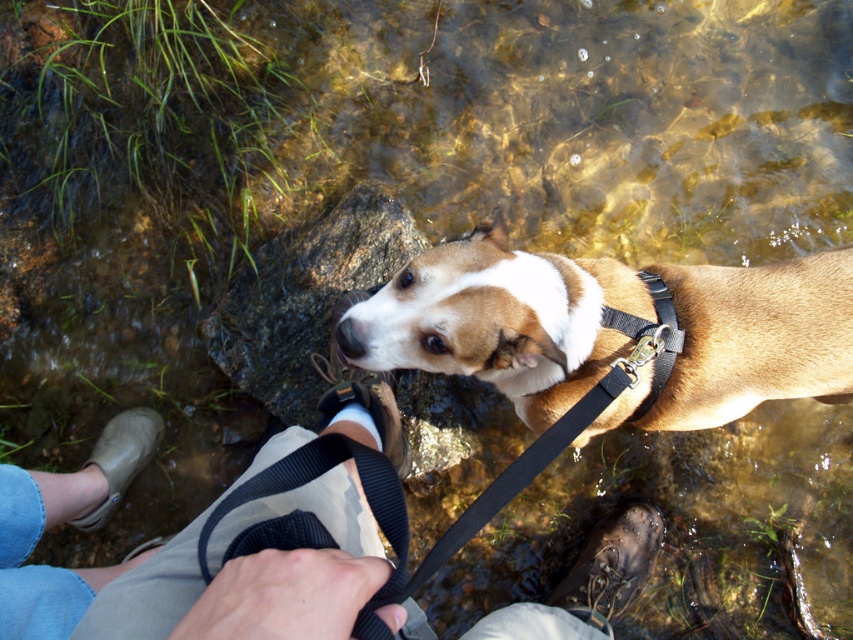
Question: Is brown matte dog at center to the right of brown leather boot at lower right from the viewer's perspective?

Choices:
 (A) no
 (B) yes

Answer: (A)

Question: Which point is farther to the camera?

Choices:
 (A) (328, 232)
 (B) (332, 538)

Answer: (A)

Question: Is brown matte dog at center below tan rubber boot at lower left?

Choices:
 (A) no
 (B) yes

Answer: (A)

Question: Which of the following is the farthest from the observer?

Choices:
 (A) (416, 246)
 (B) (601, 364)

Answer: (A)

Question: Estimate the real-world distances between objects in this image. Which object is closer to the brown leather shoe at center?

Choices:
 (A) brown matte dog at center
 (B) brown rough rock at center

Answer: (B)

Question: Does tan canvas pants at lower center appear under brown leather boot at lower right?

Choices:
 (A) yes
 (B) no

Answer: (B)